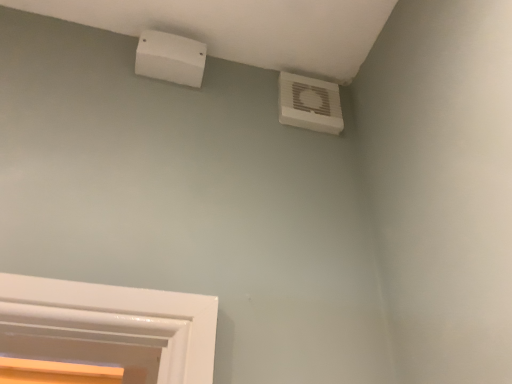
Question: Is white plastic air conditioning at upper left, which is the 2th air conditioning in right-to-left order, inside the boundaries of white plastic air conditioning unit at upper right, positioned as the second air conditioning in left-to-right order, or outside?

Choices:
 (A) outside
 (B) inside

Answer: (A)

Question: Is white plastic air conditioning at upper left, which appears as the 1th air conditioning when viewed from the left, in front of or behind white plastic air conditioning unit at upper right, positioned as the second air conditioning in left-to-right order, in the image?

Choices:
 (A) front
 (B) behind

Answer: (A)

Question: Based on their positions, is white plastic air conditioning at upper left, which appears as the 1th air conditioning when viewed from the left, located to the left or right of white plastic air conditioning unit at upper right, which is the 1th air conditioning from right to left?

Choices:
 (A) right
 (B) left

Answer: (B)

Question: Relative to white plastic air conditioning at upper left, which is the 2th air conditioning in right-to-left order, is white plastic air conditioning unit at upper right, positioned as the second air conditioning in left-to-right order, in front or behind?

Choices:
 (A) behind
 (B) front

Answer: (A)

Question: Considering the positions of white plastic air conditioning unit at upper right, positioned as the second air conditioning in left-to-right order, and white plastic air conditioning at upper left, which is the 2th air conditioning in right-to-left order, in the image, is white plastic air conditioning unit at upper right, positioned as the second air conditioning in left-to-right order, taller or shorter than white plastic air conditioning at upper left, which is the 2th air conditioning in right-to-left order,?

Choices:
 (A) tall
 (B) short

Answer: (A)

Question: Is point (332, 89) closer or farther from the camera than point (142, 71)?

Choices:
 (A) closer
 (B) farther

Answer: (B)

Question: From a real-world perspective, is white plastic air conditioning unit at upper right, positioned as the second air conditioning in left-to-right order, positioned above or below white plastic air conditioning at upper left, which appears as the 1th air conditioning when viewed from the left?

Choices:
 (A) above
 (B) below

Answer: (B)